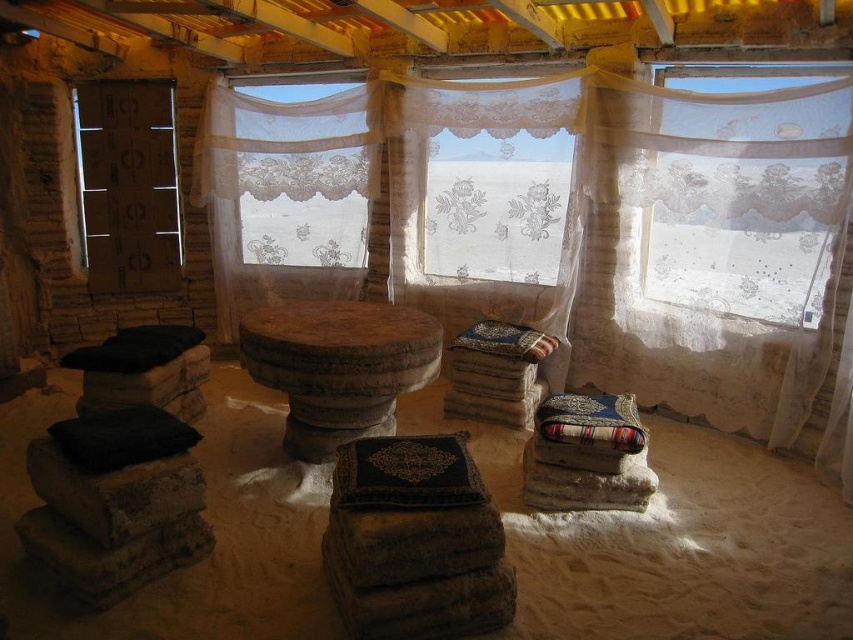
You are standing in the room and want to move from the entrance to the center table. There are two points marked in the scene, point 1 at coordinates point (74, 444) and point 2 at coordinates point (520, 349). Which point should you pass through to reach the table more directly?

You should pass through point (74, 444) to reach the table more directly because it is in front of point (520, 349), meaning it is closer to the table.